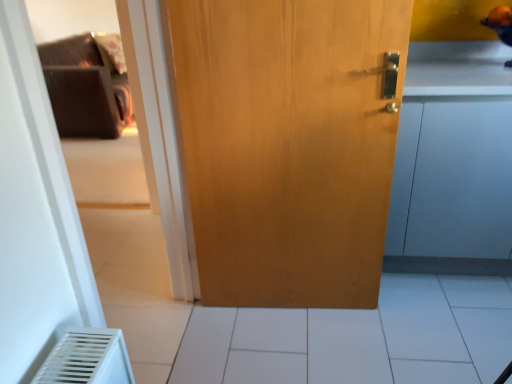
Question: Considering the positions of white tile at center and light brown wood door at center in the image, is white tile at center bigger or smaller than light brown wood door at center?

Choices:
 (A) big
 (B) small

Answer: (A)

Question: From the image's perspective, relative to light brown wood door at center, is white tile at center above or below?

Choices:
 (A) below
 (B) above

Answer: (A)

Question: Which of these objects is positioned closest to the matte wood cabinet at right?

Choices:
 (A) white tile at center
 (B) light brown wood door at center

Answer: (B)

Question: Which of these objects is positioned farthest from the light brown wood door at center?

Choices:
 (A) white tile at center
 (B) matte wood cabinet at right

Answer: (A)